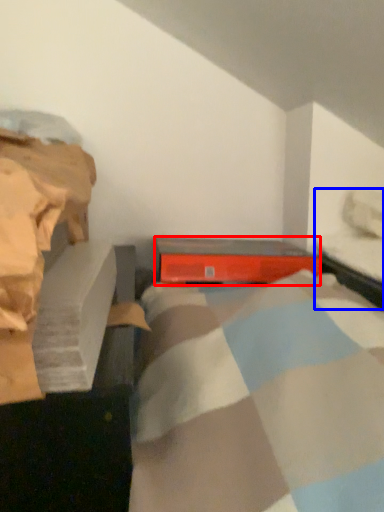
Question: Which of the following is the farthest to the observer, equipment (highlighted by a red box) or bed frame (highlighted by a blue box)?

Choices:
 (A) equipment
 (B) bed frame

Answer: (A)